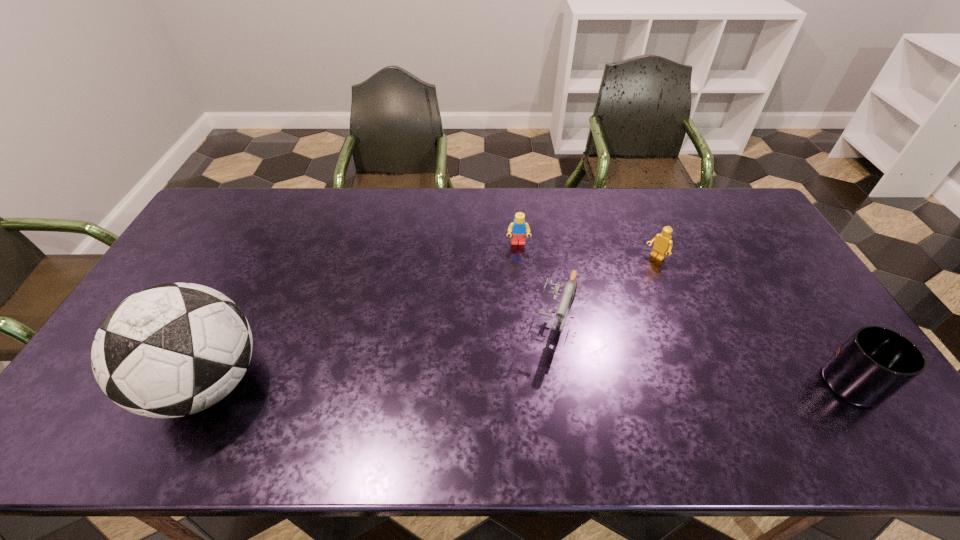
Locate an element on the screen. This screenshot has height=540, width=960. vacant area located on the surface of the leftmost object where the brand logo is visible is located at coordinates (108, 384).

I want to click on free region located 0.140m at the barrel end of the gun, so click(539, 394).

The image size is (960, 540). I want to click on blank space located 0.080m at the barrel end of the gun, so click(545, 374).

The height and width of the screenshot is (540, 960). Identify the location of free location located at the barrel end of the gun. (536, 404).

Find the location of a particular element. Image resolution: width=960 pixels, height=540 pixels. vacant region located on the face of the nearer Lego is located at coordinates (609, 298).

I want to click on vacant space located 0.360m on the face of the nearer Lego, so click(579, 323).

Identify the location of vacant space situated 0.380m on the face of the nearer Lego. This screenshot has width=960, height=540. (575, 327).

Find the location of a particular element. vacant space located 0.360m on the front-facing side of the farther Lego is located at coordinates (524, 336).

Locate an element on the screen. The height and width of the screenshot is (540, 960). blank space located 0.260m on the front-facing side of the farther Lego is located at coordinates (522, 308).

Find the location of a particular element. This screenshot has height=540, width=960. vacant space situated 0.120m on the front-facing side of the farther Lego is located at coordinates (520, 274).